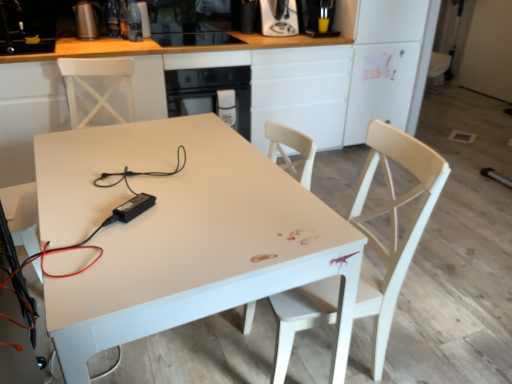
What is the approximate width of metallic silver coffee machine at upper right, arranged as the 2th coffee machine when viewed from the left?

metallic silver coffee machine at upper right, arranged as the 2th coffee machine when viewed from the left, is 44.92 centimeters in width.

Describe the element at coordinates (210, 91) in the screenshot. The height and width of the screenshot is (384, 512). I see `black glass oven at center` at that location.

This screenshot has width=512, height=384. Identify the location of black glass oven at center. (210, 91).

How much space does clear glass bottle at upper center, placed as the second appliance when sorted from left to right, occupy horizontally?

4.45 inches.

Where is `metallic silver coffee machine at upper right, the 1th coffee machine viewed from the right`? metallic silver coffee machine at upper right, the 1th coffee machine viewed from the right is located at coordinates (317, 17).

Is point (277, 15) positioned in front of point (83, 29)?

That is False.

Find the location of a particular element. The width and height of the screenshot is (512, 384). the 2nd appliance positioned below the satin silver coffee machine at upper center, which ranks as the 2th coffee machine in right-to-left order (from the image's perspective) is located at coordinates (87, 19).

Looking at their sizes, would you say satin silver coffee machine at upper center, arranged as the first coffee machine when viewed from the left, is wider or thinner than metallic silver kettle at upper left, acting as the second appliance starting from the top?

Considering their sizes, satin silver coffee machine at upper center, arranged as the first coffee machine when viewed from the left, looks broader than metallic silver kettle at upper left, acting as the second appliance starting from the top.

Is point (301, 4) closer to viewer compared to point (99, 11)?

No, (301, 4) is further to viewer.

Is metallic silver coffee machine at upper right, the 1th coffee machine viewed from the right, taller or shorter than metallic silver kettle at upper left, the third appliance positioned from the right?

In the image, metallic silver coffee machine at upper right, the 1th coffee machine viewed from the right, appears to be taller than metallic silver kettle at upper left, the third appliance positioned from the right.

Which object is more forward, metallic silver coffee machine at upper right, arranged as the 2th coffee machine when viewed from the left, or metallic silver kettle at upper left, the third appliance positioned from the right?

Positioned in front is metallic silver kettle at upper left, the third appliance positioned from the right.

From the image's perspective, is metallic silver coffee machine at upper right, the 1th coffee machine viewed from the right, above white glossy table at center?

Correct, metallic silver coffee machine at upper right, the 1th coffee machine viewed from the right, appears higher than white glossy table at center in the image.

Considering the relative positions of metallic silver coffee machine at upper right, the 1th coffee machine viewed from the right, and white glossy table at center in the image provided, is metallic silver coffee machine at upper right, the 1th coffee machine viewed from the right, to the right of white glossy table at center from the viewer's perspective?

Indeed, metallic silver coffee machine at upper right, the 1th coffee machine viewed from the right, is positioned on the right side of white glossy table at center.

Is metallic silver coffee machine at upper right, arranged as the 2th coffee machine when viewed from the left, not near white glossy table at center?

Absolutely, metallic silver coffee machine at upper right, arranged as the 2th coffee machine when viewed from the left, is distant from white glossy table at center.

Which is in front, metallic silver coffee machine at upper right, arranged as the 2th coffee machine when viewed from the left, or white glossy cabinet at center?

white glossy cabinet at center is closer to the camera.

Is metallic silver coffee machine at upper right, the 1th coffee machine viewed from the right, positioned with its back to white glossy cabinet at center?

No, metallic silver coffee machine at upper right, the 1th coffee machine viewed from the right, is not facing away from white glossy cabinet at center.

From the image's perspective, is metallic silver coffee machine at upper right, the 1th coffee machine viewed from the right, on top of white glossy cabinet at center?

Yes.

From a real-world perspective, is metallic silver coffee machine at upper right, arranged as the 2th coffee machine when viewed from the left, physically above white glossy cabinet at center?

Indeed, from a real-world perspective, metallic silver coffee machine at upper right, arranged as the 2th coffee machine when viewed from the left, stands above white glossy cabinet at center.

Is white wood chair at right inside the boundaries of white glossy cabinet at center, or outside?

The correct answer is: outside.

Locate an element on the screen. chair below the white glossy cabinet at center (from a real-world perspective) is located at coordinates (392, 224).

From a real-world perspective, is white wood chair at right positioned above or below white glossy cabinet at center?

From a real-world perspective, white wood chair at right is physically below white glossy cabinet at center.

Which of these two, white wood chair at right or white glossy cabinet at center, stands shorter?

Standing shorter between the two is white wood chair at right.

From a real-world perspective, who is located higher, metallic silver coffee machine at upper right, arranged as the 2th coffee machine when viewed from the left, or black glass oven at center?

In real-world perspective, metallic silver coffee machine at upper right, arranged as the 2th coffee machine when viewed from the left, is above.

Who is shorter, metallic silver coffee machine at upper right, arranged as the 2th coffee machine when viewed from the left, or black glass oven at center?

Standing shorter between the two is metallic silver coffee machine at upper right, arranged as the 2th coffee machine when viewed from the left.

Considering the relative sizes of metallic silver coffee machine at upper right, the 1th coffee machine viewed from the right, and black glass oven at center in the image provided, is metallic silver coffee machine at upper right, the 1th coffee machine viewed from the right, wider than black glass oven at center?

In fact, metallic silver coffee machine at upper right, the 1th coffee machine viewed from the right, might be narrower than black glass oven at center.

Does point (302, 18) come farther from viewer compared to point (231, 80)?

That is True.

Is white glossy cabinet at center not near metallic silver kettle at upper left, which appears as the second appliance when ordered from the bottom?

Absolutely, white glossy cabinet at center is distant from metallic silver kettle at upper left, which appears as the second appliance when ordered from the bottom.

Is point (359, 103) closer to viewer compared to point (83, 25)?

No.

Which object is positioned more to the right, white glossy cabinet at center or metallic silver kettle at upper left, which appears as the second appliance when ordered from the bottom?

white glossy cabinet at center is more to the right.

From the image's perspective, between white glossy cabinet at center and metallic silver kettle at upper left, the 3th appliance positioned from the front, who is located below?

From the image's view, white glossy cabinet at center is below.

Identify the location of coffee machine that is the 1st object located above the metallic silver kettle at upper left, the 3th appliance positioned from the front (from the image's perspective). (278, 17).

Find the location of `appliance that is the 1st one below the metallic silver coffee machine at upper right, the 1th coffee machine viewed from the right (from a real-world perspective)`. appliance that is the 1st one below the metallic silver coffee machine at upper right, the 1th coffee machine viewed from the right (from a real-world perspective) is located at coordinates (87, 19).

Based on their spatial positions, is white glossy cabinet at center or black plastic power adapter at center, which is the 1th appliance in bottom-to-top order, closer to metallic silver coffee machine at upper right, the 1th coffee machine viewed from the right?

white glossy cabinet at center lies closer to metallic silver coffee machine at upper right, the 1th coffee machine viewed from the right, than the other object.

Based on their spatial positions, is metallic silver coffee machine at upper right, arranged as the 2th coffee machine when viewed from the left, or metallic silver kettle at upper left, which is the first appliance from left to right, closer to clear glass bottle at upper center, the second appliance viewed from the back?

Among the two, metallic silver kettle at upper left, which is the first appliance from left to right, is located nearer to clear glass bottle at upper center, the second appliance viewed from the back.

Based on their spatial positions, is clear glass bottle at upper center, which ranks as the 3th appliance in bottom-to-top order, or metallic silver coffee machine at upper right, the 1th coffee machine viewed from the right, closer to white glossy cabinet at center?

Among the two, metallic silver coffee machine at upper right, the 1th coffee machine viewed from the right, is located nearer to white glossy cabinet at center.

When comparing their distances from black plastic power adapter at center, which is counted as the 3th appliance, starting from the back, does metallic silver kettle at upper left, acting as the second appliance starting from the top, or clear glass bottle at upper center, the second appliance positioned from the right, seem further?

metallic silver kettle at upper left, acting as the second appliance starting from the top, is positioned further to the anchor black plastic power adapter at center, which is counted as the 3th appliance, starting from the back.

From the image, which object appears to be nearer to metallic silver kettle at upper left, the third appliance positioned from the right, black glass oven at center or satin silver coffee machine at upper center, which ranks as the 2th coffee machine in right-to-left order?

black glass oven at center is positioned closer to the anchor metallic silver kettle at upper left, the third appliance positioned from the right.

Which object lies further to the anchor point satin silver coffee machine at upper center, which ranks as the 2th coffee machine in right-to-left order, white glossy cabinet at center or black plastic power adapter at center, the 1th appliance in the right-to-left sequence?

Among the two, black plastic power adapter at center, the 1th appliance in the right-to-left sequence, is located further to satin silver coffee machine at upper center, which ranks as the 2th coffee machine in right-to-left order.

From the image, which object appears to be farther from white glossy table at center, black plastic power adapter at center, the 1th appliance in the right-to-left sequence, or metallic silver coffee machine at upper right, arranged as the 2th coffee machine when viewed from the left?

The object further to white glossy table at center is metallic silver coffee machine at upper right, arranged as the 2th coffee machine when viewed from the left.

From the image, which object appears to be farther from white wood chair at right, clear glass bottle at upper center, which is the first appliance in top-to-bottom order, or metallic silver coffee machine at upper right, the 1th coffee machine viewed from the right?

The object further to white wood chair at right is clear glass bottle at upper center, which is the first appliance in top-to-bottom order.

Where is `cabinetry positioned between white wood chair at right and black glass oven at center from near to far`? The height and width of the screenshot is (384, 512). cabinetry positioned between white wood chair at right and black glass oven at center from near to far is located at coordinates (321, 74).

The image size is (512, 384). I want to click on appliance between metallic silver kettle at upper left, acting as the second appliance starting from the top, and black glass oven at center from left to right, so click(x=135, y=20).

This screenshot has width=512, height=384. I want to click on cabinetry positioned between white glossy table at center and metallic silver kettle at upper left, which is the first appliance from left to right, from near to far, so click(321, 74).

Find the location of a particular element. cabinetry between black plastic power adapter at center, positioned as the third appliance in top-to-bottom order, and metallic silver coffee machine at upper right, the 1th coffee machine viewed from the right, in the front-back direction is located at coordinates pos(321,74).